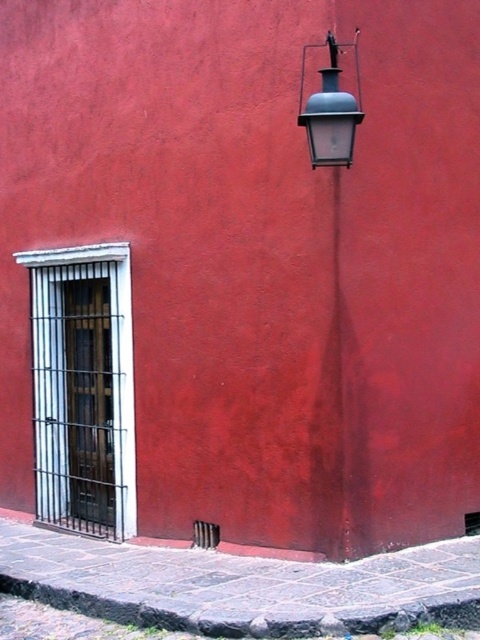
You are an interior designer assessing the placement of two lamps on a red wall. You have the matte blue glass lamp at upper right and the matte gray lantern at upper right. Which of these two lamps has a smaller width?

The matte blue glass lamp at upper right is thinner than the matte gray lantern at upper right, so it has a smaller width.

You are an interior designer assessing the wall space between the two lamps. The matte blue glass lamp at upper right and the matte gray lantern at upper right are both mounted on the same wall. Which of the two occupies a smaller area on the wall?

The matte blue glass lamp at upper right occupies less space than the matte gray lantern at upper right, so it takes up a smaller area on the wall.

You are standing in front of the red wall and notice two points marked on it. The first point is at coordinates point (328, 520) and the second is at point (313, 129). Which point is closer to you?

Point (328, 520) is further to the viewer than point (313, 129), so the closer point to you is point (328, 520).